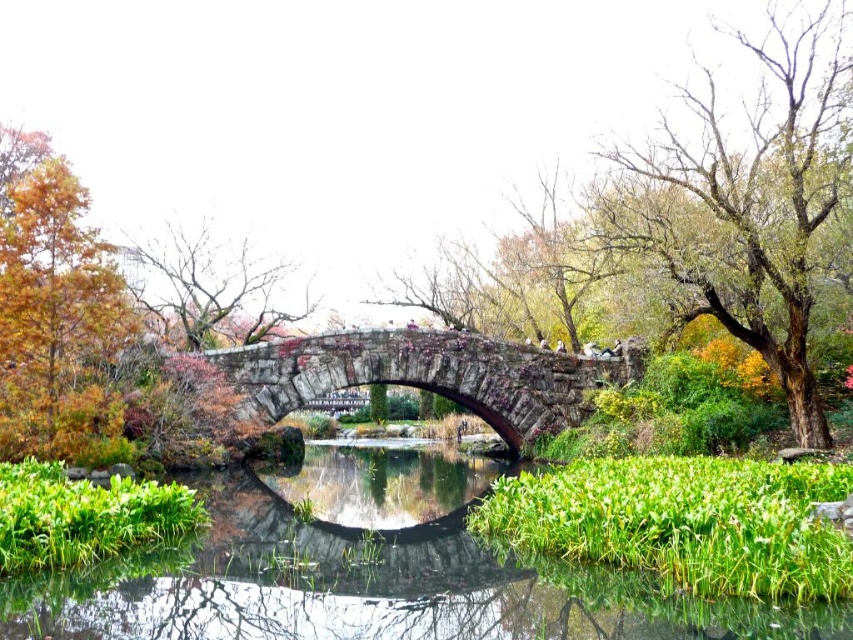
Question: Which of the following is the closest to the observer?

Choices:
 (A) (784, 189)
 (B) (628, 349)

Answer: (A)

Question: Can you confirm if bare wood tree at upper right is positioned above bare branches at upper left?

Choices:
 (A) no
 (B) yes

Answer: (B)

Question: Is rustic stone bridge at center to the left of bare branches at upper left from the viewer's perspective?

Choices:
 (A) no
 (B) yes

Answer: (A)

Question: Among these points, which one is nearest to the camera?

Choices:
 (A) (792, 160)
 (B) (817, 611)
 (C) (426, 342)
 (D) (149, 316)

Answer: (B)

Question: Which point is farther from the camera taking this photo?

Choices:
 (A) (637, 172)
 (B) (369, 472)
 (C) (68, 333)
 (D) (247, 253)

Answer: (D)

Question: Is bare wood tree at upper right to the right of orange leafy tree at left from the viewer's perspective?

Choices:
 (A) no
 (B) yes

Answer: (B)